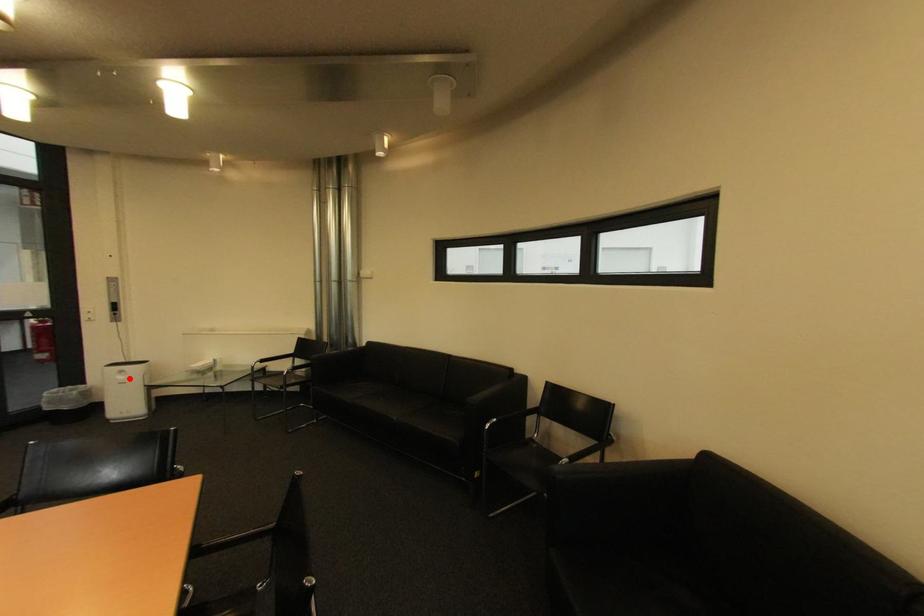
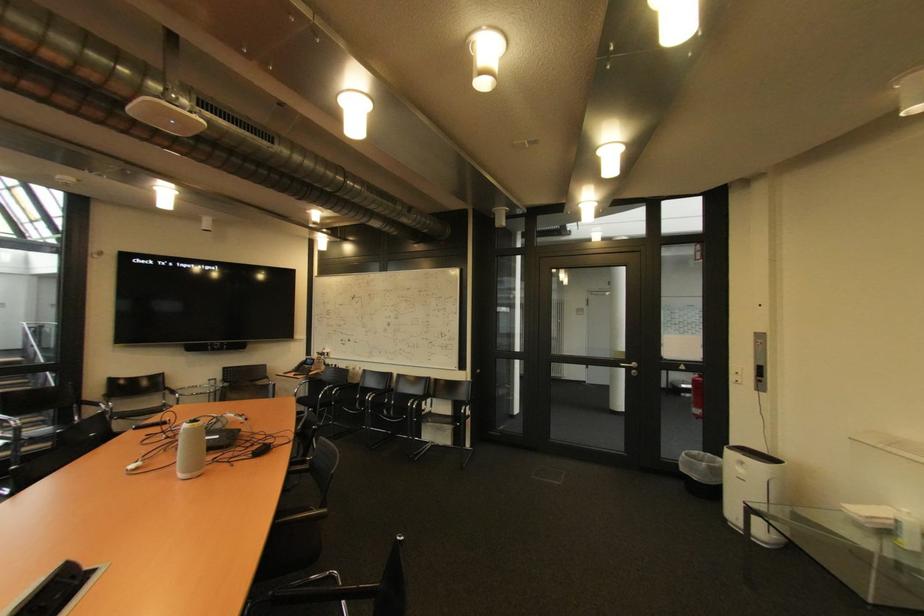
Question: I am providing you with two images of the same scene from different viewpoints. In image1, a red point is highlighted. Considering the same 3D point in image2, which of the following is correct?

Choices:
 (A) It is closer
 (B) It is farther

Answer: (B)